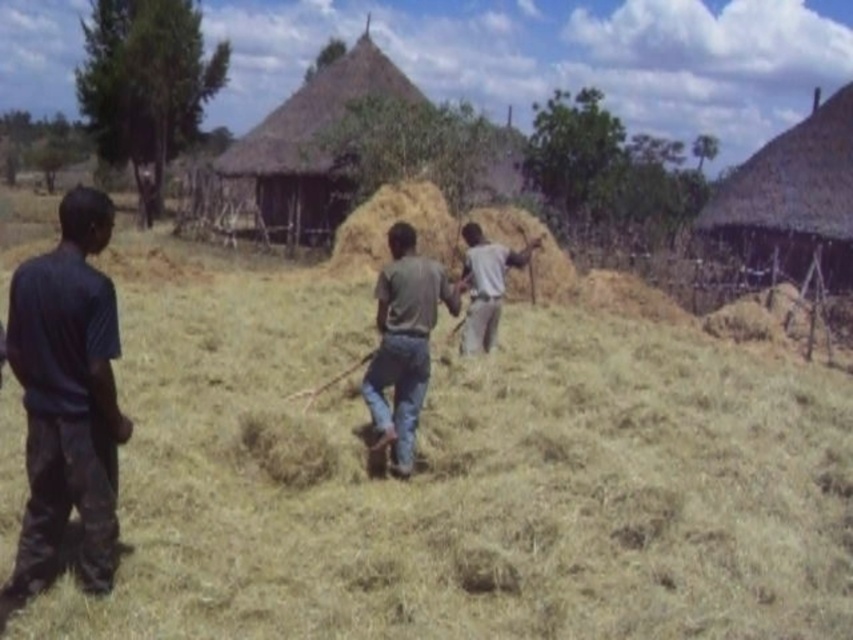
Question: Is dry straw at center above dark gray jeans at center?

Choices:
 (A) yes
 (B) no

Answer: (A)

Question: Which point is farther to the camera?

Choices:
 (A) (494, 332)
 (B) (102, 218)
 (C) (413, 337)

Answer: (A)

Question: Which object appears closest to the camera in this image?

Choices:
 (A) gray matte shirt at center
 (B) dry straw at center

Answer: (B)

Question: Which point appears closest to the camera in this image?

Choices:
 (A) (305, 301)
 (B) (425, 301)
 (C) (74, 230)

Answer: (C)

Question: Can you confirm if dark blue shirt at left is bigger than gray matte shirt at center?

Choices:
 (A) no
 (B) yes

Answer: (B)

Question: Does dry straw at center appear on the right side of gray matte shirt at center?

Choices:
 (A) yes
 (B) no

Answer: (B)